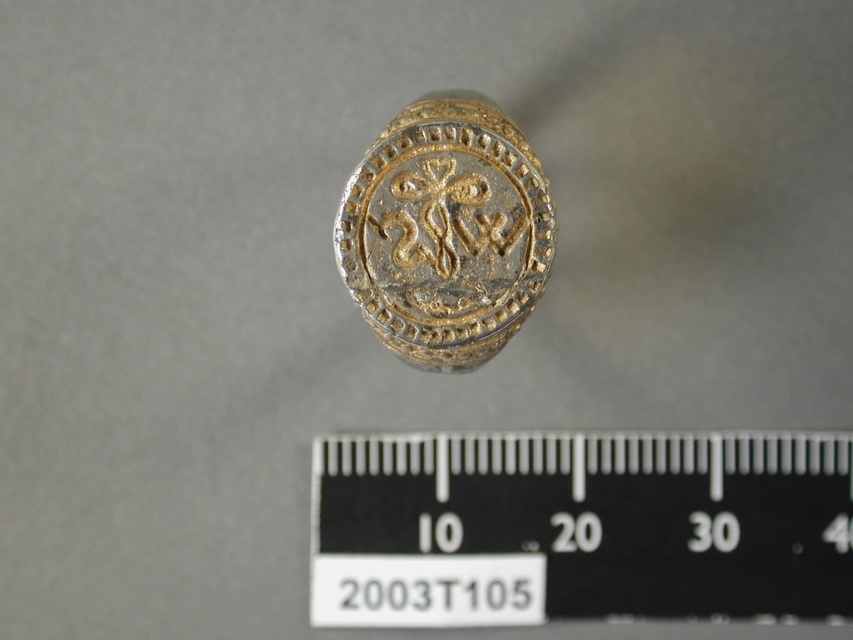
Between black plastic ruler at center and gold plated ring at center, which one is positioned lower?

black plastic ruler at center

Which is behind, point (538, 620) or point (366, 163)?

Point (538, 620)

Where is `black plastic ruler at center`? The height and width of the screenshot is (640, 853). black plastic ruler at center is located at coordinates coord(579,528).